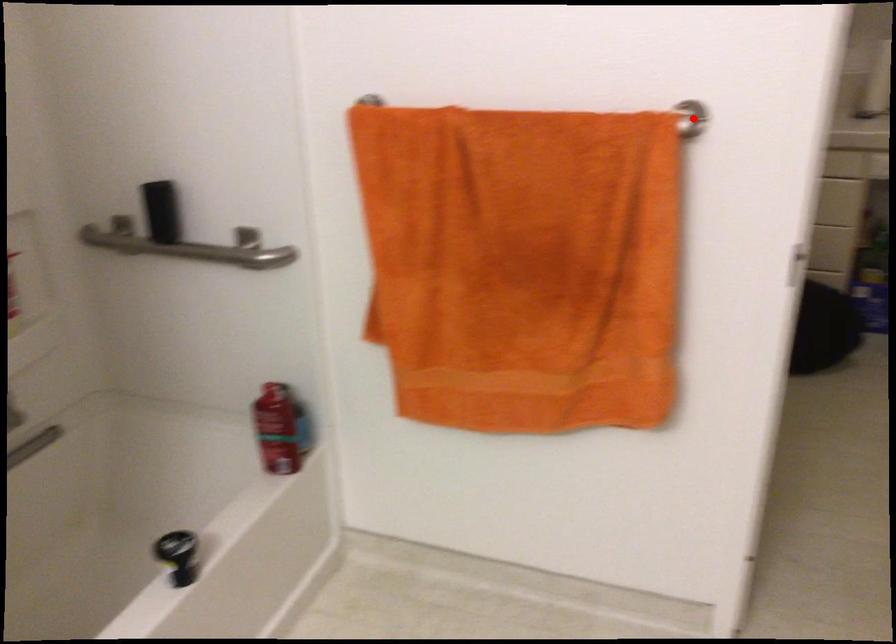
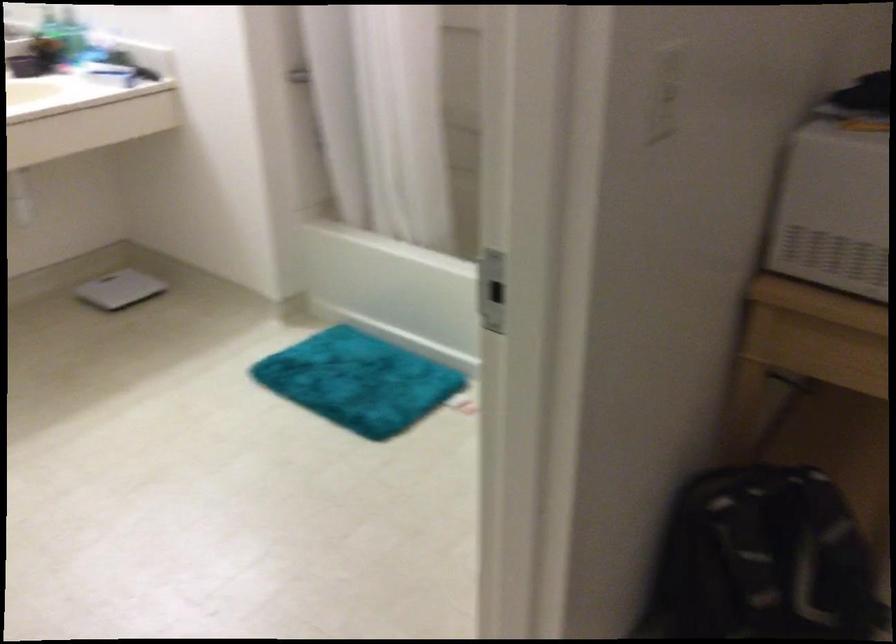
Locate, in the second image, the point that corresponds to the highlighted location in the first image.

(666, 93)